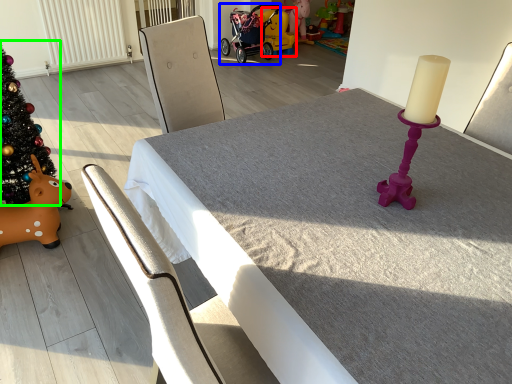
Question: Which object is positioned closest to toy (highlighted by a red box)? Select from baby carriage (highlighted by a blue box) and christmas tree (highlighted by a green box).

Choices:
 (A) baby carriage
 (B) christmas tree

Answer: (A)